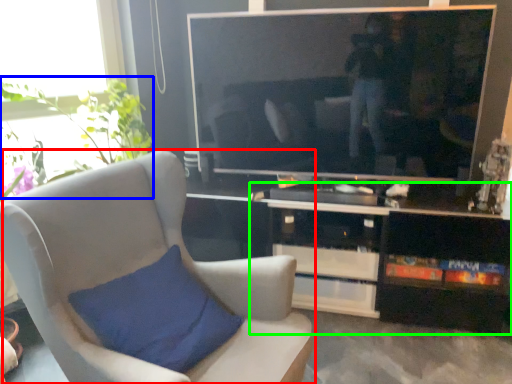
Question: Based on their relative distances, which object is nearer to chair (highlighted by a red box)? Choose from plant (highlighted by a blue box) and cabinetry (highlighted by a green box).

Choices:
 (A) plant
 (B) cabinetry

Answer: (B)